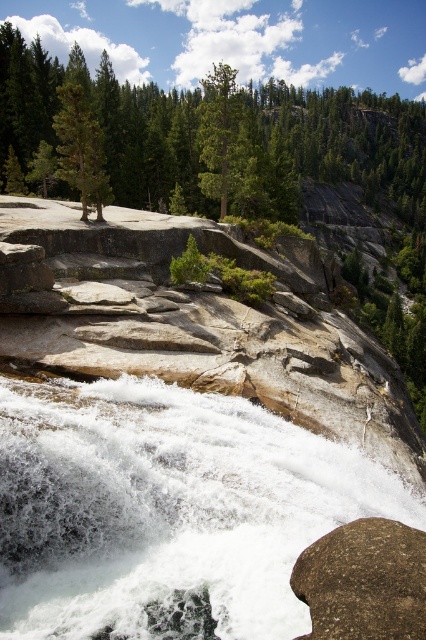
Question: Does white frothy water at center have a lesser width compared to green matte tree at upper center?

Choices:
 (A) yes
 (B) no

Answer: (B)

Question: Which point is closer to the camera?

Choices:
 (A) (95, 513)
 (B) (206, 102)
 (C) (2, 170)
 (D) (342, 628)

Answer: (D)

Question: Does brown rough rock at lower right have a lesser width compared to green matte tree at upper center?

Choices:
 (A) no
 (B) yes

Answer: (B)

Question: Which is farther from the brown rough rock at lower right?

Choices:
 (A) green matte tree at upper center
 (B) green matte tree at left
 (C) white frothy water at center

Answer: (A)

Question: Is white frothy water at center smaller than green matte tree at upper center?

Choices:
 (A) yes
 (B) no

Answer: (A)

Question: Among these points, which one is farthest from the camera?

Choices:
 (A) coord(337,596)
 (B) coord(215,148)
 (C) coord(101,172)
 (D) coord(210,200)

Answer: (D)